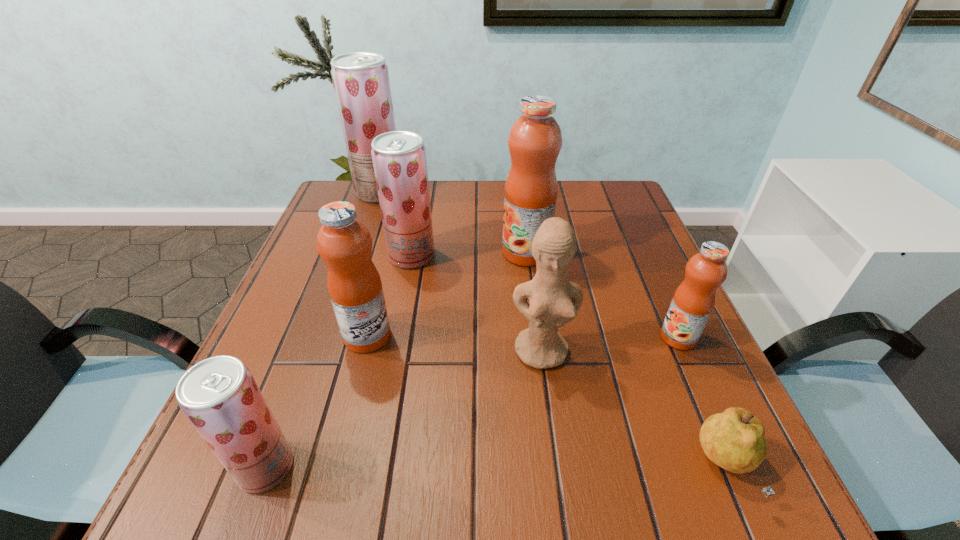
This screenshot has width=960, height=540. In order to click on free space between the biggest orange fruit juice and the leftmost orange fruit juice in this screenshot , I will do `click(446, 294)`.

Find the location of a particular element. Image resolution: width=960 pixels, height=540 pixels. free spot between the rightmost fruit juice and the farthest orange fruit juice is located at coordinates (602, 295).

Find the location of a particular element. Image resolution: width=960 pixels, height=540 pixels. blank region between the second farthest strawberry fruit juice and the figurine is located at coordinates (477, 303).

The image size is (960, 540). What are the coordinates of `vacant region between the farthest object and the figurine` in the screenshot? It's located at (461, 272).

Identify the location of free spot between the nearest fruit juice and the figurine. (404, 409).

What are the coordinates of `object that is the seventh closest to the smallest orange fruit juice` in the screenshot? It's located at (361, 83).

Locate an element on the screen. This screenshot has height=540, width=960. object that stands as the fourth closest to the rightmost strawberry fruit juice is located at coordinates (554, 301).

Select which fruit juice appears as the closest to the figurine. Please provide its 2D coordinates. Your answer should be formatted as a tuple, i.e. [(x, y)], where the tuple contains the x and y coordinates of a point satisfying the conditions above.

[(693, 302)]

Where is `fruit juice that can be found as the fifth closest to the farthest strawberry fruit juice`? fruit juice that can be found as the fifth closest to the farthest strawberry fruit juice is located at coordinates (693, 302).

Point out which strawberry fruit juice is positioned as the second nearest to the second smallest orange fruit juice. Please provide its 2D coordinates. Your answer should be formatted as a tuple, i.e. [(x, y)], where the tuple contains the x and y coordinates of a point satisfying the conditions above.

[(219, 396)]